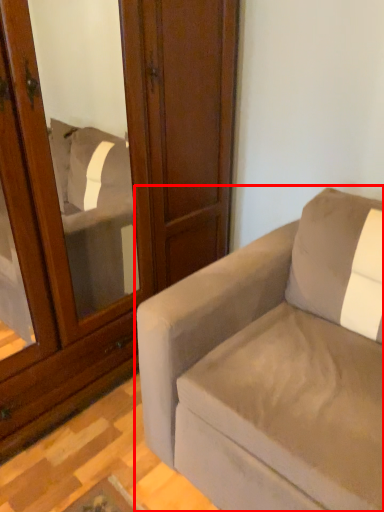
Question: From the image's perspective, what is the correct spatial positioning of studio couch (annotated by the red box) in reference to screen door?

Choices:
 (A) above
 (B) below

Answer: (B)